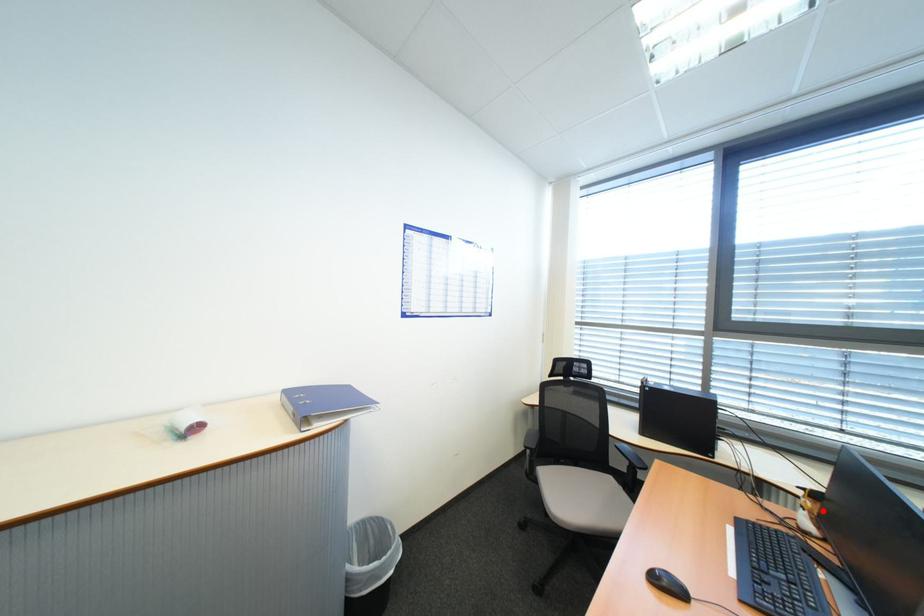
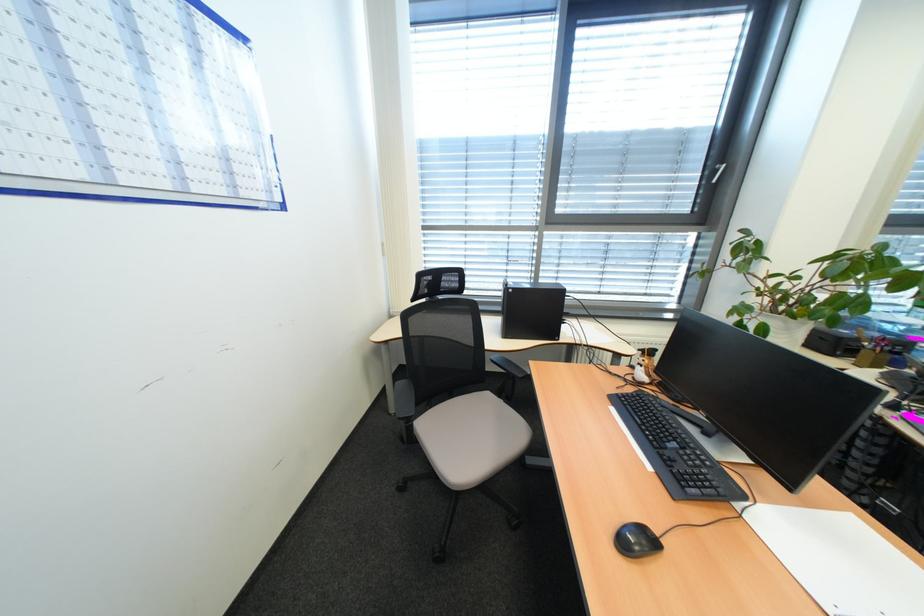
Question: I am providing you with two images of the same scene from different viewpoints. In image1, a red point is highlighted. Considering the same 3D point in image2, which of the following is correct?

Choices:
 (A) It is closer
 (B) It is farther

Answer: (A)